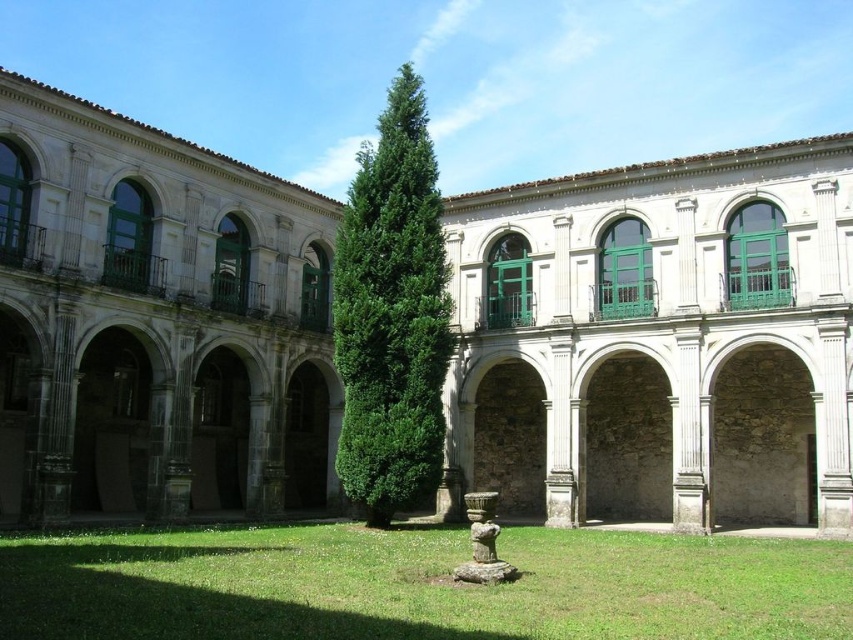
Question: Which point appears farthest from the camera in this image?

Choices:
 (A) (700, 596)
 (B) (675, 278)

Answer: (B)

Question: Is stone arches at center to the right of green leafy tree at center from the viewer's perspective?

Choices:
 (A) no
 (B) yes

Answer: (B)

Question: Can you confirm if stone arches at center is wider than green grass at center?

Choices:
 (A) no
 (B) yes

Answer: (B)

Question: Considering the relative positions of stone arches at center and green leafy tree at center in the image provided, where is stone arches at center located with respect to green leafy tree at center?

Choices:
 (A) left
 (B) right

Answer: (B)

Question: Which of the following is the farthest from the observer?

Choices:
 (A) (120, 410)
 (B) (35, 589)
 (C) (390, 192)

Answer: (A)

Question: Which object is farther from the camera taking this photo?

Choices:
 (A) green grass at center
 (B) stone arches at center

Answer: (B)